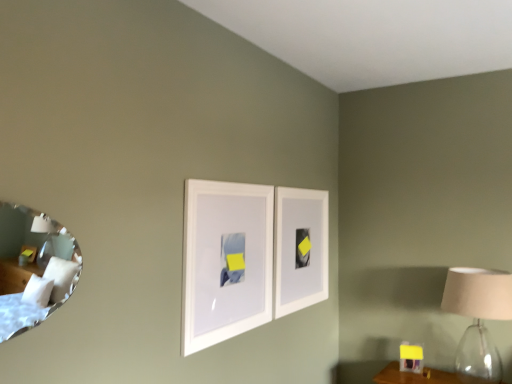
Locate an element on the screen. This screenshot has height=384, width=512. white matte picture frame at center, the 1th picture frame from the back is located at coordinates (300, 249).

How much space does white matte picture frame at center, marked as the first picture frame in a left-to-right arrangement, occupy horizontally?

The width of white matte picture frame at center, marked as the first picture frame in a left-to-right arrangement, is 3.65 centimeters.

You are a GUI agent. You are given a task and a screenshot of the screen. Output one action in this format:
    pyautogui.click(x=<x>, y=<y>)
    Task: Click on the silver reflective mirror at left
    The height and width of the screenshot is (384, 512).
    Given the screenshot: What is the action you would take?
    pyautogui.click(x=35, y=272)

Does white matte picture frame at center, which appears as the second picture frame when viewed from the back, turn towards silver reflective mirror at left?

No, white matte picture frame at center, which appears as the second picture frame when viewed from the back, does not turn towards silver reflective mirror at left.

Are white matte picture frame at center, marked as the first picture frame in a left-to-right arrangement, and silver reflective mirror at left making contact?

No, white matte picture frame at center, marked as the first picture frame in a left-to-right arrangement, is not next to silver reflective mirror at left.

Is white matte picture frame at center, which appears as the second picture frame when viewed from the back, to the left of silver reflective mirror at left from the viewer's perspective?

Incorrect, white matte picture frame at center, which appears as the second picture frame when viewed from the back, is not on the left side of silver reflective mirror at left.

Considering the sizes of white matte picture frame at center, marked as the first picture frame in a left-to-right arrangement, and silver reflective mirror at left in the image, is white matte picture frame at center, marked as the first picture frame in a left-to-right arrangement, wider or thinner than silver reflective mirror at left?

Considering their sizes, white matte picture frame at center, marked as the first picture frame in a left-to-right arrangement, looks slimmer than silver reflective mirror at left.

Which object is thinner, silver reflective mirror at left or white matte picture frame at center, the 1th picture frame from the back?

white matte picture frame at center, the 1th picture frame from the back, is thinner.

Based on the photo, is silver reflective mirror at left at the left side of white matte picture frame at center, acting as the second picture frame starting from the front?

Indeed, silver reflective mirror at left is positioned on the left side of white matte picture frame at center, acting as the second picture frame starting from the front.

Is silver reflective mirror at left beside white matte picture frame at center, the 1th picture frame from the back?

No, silver reflective mirror at left is not next to white matte picture frame at center, the 1th picture frame from the back.

Is silver reflective mirror at left oriented away from white matte picture frame at center, acting as the first picture frame starting from the right?

No.

Relative to white matte picture frame at center, the first picture frame viewed from the front, is matte beige lampshade at right in front or behind?

Clearly, matte beige lampshade at right is behind white matte picture frame at center, the first picture frame viewed from the front.

In terms of size, does matte beige lampshade at right appear bigger or smaller than white matte picture frame at center, the first picture frame viewed from the front?

Clearly, matte beige lampshade at right is larger in size than white matte picture frame at center, the first picture frame viewed from the front.

Which is nearer, (470, 299) or (194, 214)?

Point (194, 214)

Between silver reflective mirror at left and matte beige lampshade at right, which one has smaller width?

Thinner between the two is silver reflective mirror at left.

Is silver reflective mirror at left positioned beyond the bounds of matte beige lampshade at right?

silver reflective mirror at left is positioned outside matte beige lampshade at right.

Considering the points (60, 275) and (458, 350), which point is behind, point (60, 275) or point (458, 350)?

The point (458, 350) is more distant.

From their relative heights in the image, would you say white matte picture frame at center, acting as the second picture frame starting from the front, is taller or shorter than silver reflective mirror at left?

white matte picture frame at center, acting as the second picture frame starting from the front, is taller than silver reflective mirror at left.

Between white matte picture frame at center, acting as the second picture frame starting from the front, and silver reflective mirror at left, which one has larger size?

white matte picture frame at center, acting as the second picture frame starting from the front, is bigger.

Does white matte picture frame at center, the 2th picture frame in the left-to-right sequence, turn towards silver reflective mirror at left?

No, white matte picture frame at center, the 2th picture frame in the left-to-right sequence, does not turn towards silver reflective mirror at left.

Is white matte picture frame at center, which appears as the second picture frame when viewed from the back, inside or outside of white matte picture frame at center, the 1th picture frame from the back?

white matte picture frame at center, which appears as the second picture frame when viewed from the back, is located beyond the bounds of white matte picture frame at center, the 1th picture frame from the back.

From their relative heights in the image, would you say white matte picture frame at center, the first picture frame viewed from the front, is taller or shorter than white matte picture frame at center, acting as the first picture frame starting from the right?

Clearly, white matte picture frame at center, the first picture frame viewed from the front, is shorter compared to white matte picture frame at center, acting as the first picture frame starting from the right.

Does white matte picture frame at center, the first picture frame viewed from the front, have a lesser width compared to white matte picture frame at center, acting as the first picture frame starting from the right?

Correct, the width of white matte picture frame at center, the first picture frame viewed from the front, is less than that of white matte picture frame at center, acting as the first picture frame starting from the right.

From a real-world perspective, relative to white matte picture frame at center, acting as the first picture frame starting from the right, is white matte picture frame at center, the first picture frame viewed from the front, vertically above or below?

white matte picture frame at center, the first picture frame viewed from the front, is below white matte picture frame at center, acting as the first picture frame starting from the right.

Could you tell me if matte beige lampshade at right is turned towards white matte picture frame at center, acting as the second picture frame starting from the front?

No, matte beige lampshade at right is not oriented towards white matte picture frame at center, acting as the second picture frame starting from the front.

Which object is closer to the camera, matte beige lampshade at right or white matte picture frame at center, the 2th picture frame in the left-to-right sequence?

matte beige lampshade at right is in front.

Is point (461, 363) less distant than point (282, 219)?

No, it is not.

This screenshot has width=512, height=384. Find the location of `table lamp below the white matte picture frame at center, the 2th picture frame in the left-to-right sequence (from a real-world perspective)`. table lamp below the white matte picture frame at center, the 2th picture frame in the left-to-right sequence (from a real-world perspective) is located at coordinates (478, 319).

From the silver reflective mirror at left, count 1st picture frames backward and point to it. Please provide its 2D coordinates.

[(225, 261)]

The image size is (512, 384). Identify the location of mirror to the left of white matte picture frame at center, acting as the first picture frame starting from the right. (35, 272).

In the scene shown: When comparing their distances from matte beige lampshade at right, does white matte picture frame at center, the 2th picture frame in the left-to-right sequence, or white matte picture frame at center, the first picture frame viewed from the front, seem closer?

Among the two, white matte picture frame at center, the 2th picture frame in the left-to-right sequence, is located nearer to matte beige lampshade at right.

Looking at the image, which one is located closer to white matte picture frame at center, the 1th picture frame from the back, white matte picture frame at center, the first picture frame viewed from the front, or silver reflective mirror at left?

white matte picture frame at center, the first picture frame viewed from the front.

When comparing their distances from matte beige lampshade at right, does white matte picture frame at center, which is counted as the 2th picture frame, starting from the right, or silver reflective mirror at left seem closer?

Based on the image, white matte picture frame at center, which is counted as the 2th picture frame, starting from the right, appears to be nearer to matte beige lampshade at right.

Based on the photo, estimate the real-world distances between objects in this image. Which object is closer to white matte picture frame at center, which is counted as the 2th picture frame, starting from the right, white matte picture frame at center, the 1th picture frame from the back, or matte beige lampshade at right?

The object closer to white matte picture frame at center, which is counted as the 2th picture frame, starting from the right, is white matte picture frame at center, the 1th picture frame from the back.

When comparing their distances from matte beige lampshade at right, does silver reflective mirror at left or white matte picture frame at center, the first picture frame viewed from the front, seem further?

Among the two, silver reflective mirror at left is located further to matte beige lampshade at right.

From the image, which object appears to be farther from matte beige lampshade at right, white matte picture frame at center, acting as the second picture frame starting from the front, or silver reflective mirror at left?

silver reflective mirror at left is positioned further to the anchor matte beige lampshade at right.

Consider the image. Considering their positions, is silver reflective mirror at left positioned further to matte beige lampshade at right than white matte picture frame at center, the 1th picture frame from the back?

The object further to matte beige lampshade at right is silver reflective mirror at left.

Which object lies further to the anchor point white matte picture frame at center, which is counted as the 2th picture frame, starting from the right, white matte picture frame at center, acting as the first picture frame starting from the right, or silver reflective mirror at left?

silver reflective mirror at left is further to white matte picture frame at center, which is counted as the 2th picture frame, starting from the right.

Locate an element on the screen. picture frame between silver reflective mirror at left and white matte picture frame at center, acting as the second picture frame starting from the front, along the z-axis is located at coordinates (225, 261).

Identify the location of picture frame between white matte picture frame at center, marked as the first picture frame in a left-to-right arrangement, and matte beige lampshade at right. This screenshot has height=384, width=512. (300, 249).